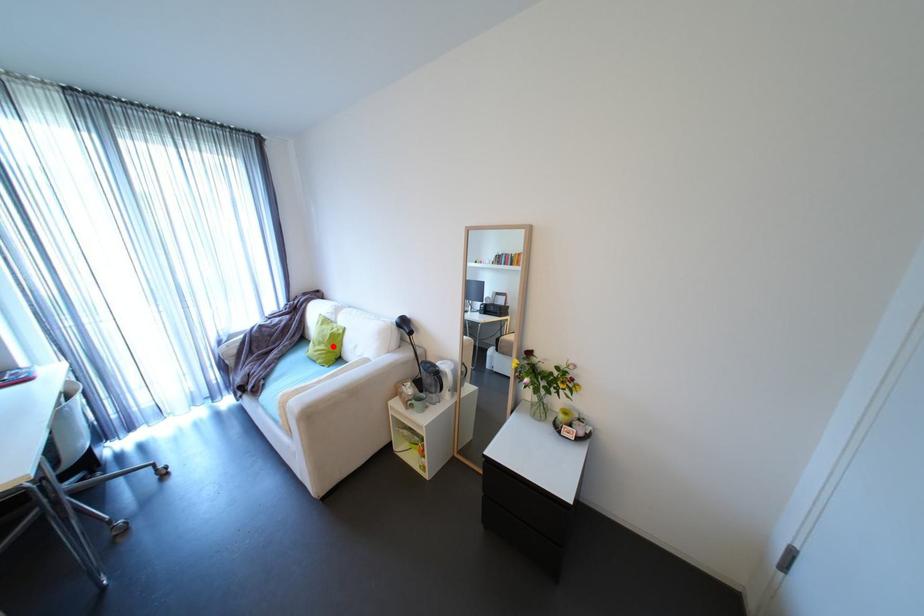
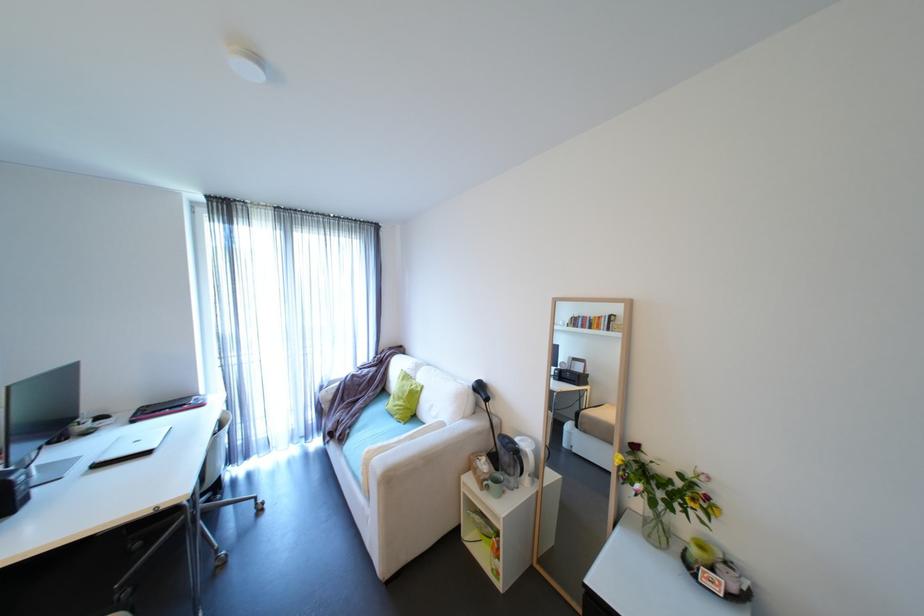
Find the pixel in the second image that matches the highlighted location in the first image.

(411, 402)